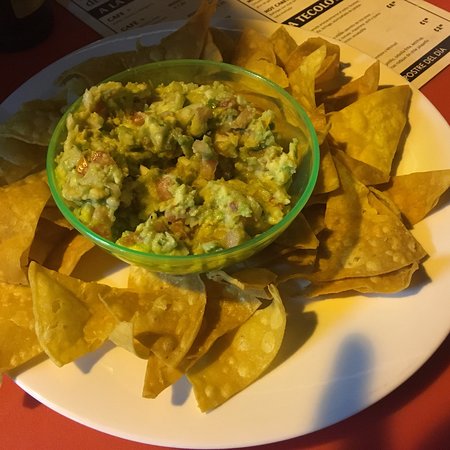
The width and height of the screenshot is (450, 450). Identify the location of round white plate. (295, 385).